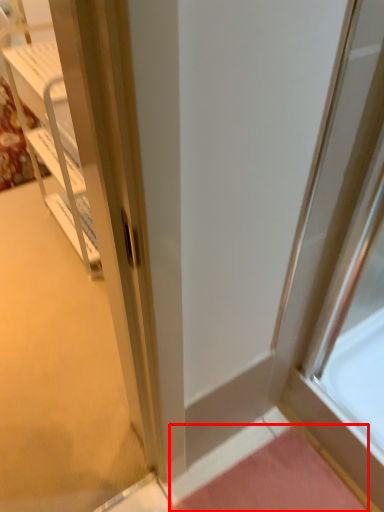
Question: From the image, what is the correct spatial relationship of doormat (annotated by the red box) in relation to cabinetry?

Choices:
 (A) right
 (B) left

Answer: (A)